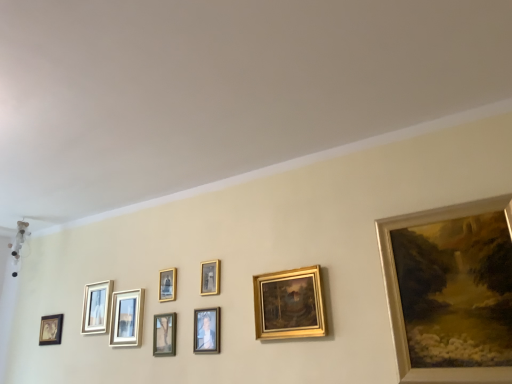
Question: Could you tell me if matte gold picture frame at center, the 6th picture frame viewed from the left, is facing matte black picture frame at lower left, which appears as the first picture frame when viewed from the left?

Choices:
 (A) yes
 (B) no

Answer: (B)

Question: Is matte gold picture frame at center, which is the 4th picture frame from right to left, at the right side of matte black picture frame at lower left, marked as the 9th picture frame in a right-to-left arrangement?

Choices:
 (A) yes
 (B) no

Answer: (A)

Question: Is matte gold picture frame at center, the 6th picture frame viewed from the left, taller than matte black picture frame at lower left, which appears as the first picture frame when viewed from the left?

Choices:
 (A) no
 (B) yes

Answer: (B)

Question: From the image's perspective, is matte gold picture frame at center, the 6th picture frame viewed from the left, located above matte black picture frame at lower left, marked as the 9th picture frame in a right-to-left arrangement?

Choices:
 (A) yes
 (B) no

Answer: (A)

Question: Is matte gold picture frame at center, which is the 4th picture frame from right to left, turned away from matte black picture frame at lower left, which appears as the first picture frame when viewed from the left?

Choices:
 (A) no
 (B) yes

Answer: (A)

Question: Considering the positions of green matte picture frame at center, the fifth picture frame when ordered from left to right, and gold metallic painting at upper right, positioned as the 1th picture frame in right-to-left order, in the image, is green matte picture frame at center, the fifth picture frame when ordered from left to right, bigger or smaller than gold metallic painting at upper right, positioned as the 1th picture frame in right-to-left order,?

Choices:
 (A) small
 (B) big

Answer: (A)

Question: From a real-world perspective, is green matte picture frame at center, marked as the 5th picture frame in a right-to-left arrangement, physically located above or below gold metallic painting at upper right, which is the 9th picture frame from left to right?

Choices:
 (A) below
 (B) above

Answer: (A)

Question: In terms of width, does green matte picture frame at center, marked as the 5th picture frame in a right-to-left arrangement, look wider or thinner when compared to gold metallic painting at upper right, which is the 9th picture frame from left to right?

Choices:
 (A) thin
 (B) wide

Answer: (A)

Question: Is green matte picture frame at center, the fifth picture frame when ordered from left to right, in front of or behind gold metallic painting at upper right, positioned as the 1th picture frame in right-to-left order, in the image?

Choices:
 (A) behind
 (B) front

Answer: (A)

Question: Is gold metallic painting at upper right, which is the 9th picture frame from left to right, spatially inside gold/gilded painting at center, which appears as the 8th picture frame when viewed from the left, or outside of it?

Choices:
 (A) outside
 (B) inside

Answer: (A)

Question: Is point (475, 284) closer or farther from the camera than point (289, 322)?

Choices:
 (A) farther
 (B) closer

Answer: (B)

Question: From the image's perspective, is gold metallic painting at upper right, which is the 9th picture frame from left to right, positioned above or below gold/gilded painting at center, which appears as the 8th picture frame when viewed from the left?

Choices:
 (A) below
 (B) above

Answer: (B)

Question: In the image, is gold metallic painting at upper right, which is the 9th picture frame from left to right, positioned in front of or behind gold/gilded painting at center, the 2th picture frame from the right?

Choices:
 (A) behind
 (B) front

Answer: (B)

Question: Considering the positions of matte black picture frame at lower left, which appears as the first picture frame when viewed from the left, and matte white picture frame at center, which appears as the third picture frame when viewed from the left, in the image, is matte black picture frame at lower left, which appears as the first picture frame when viewed from the left, taller or shorter than matte white picture frame at center, which appears as the third picture frame when viewed from the left,?

Choices:
 (A) short
 (B) tall

Answer: (A)

Question: Is matte black picture frame at lower left, which appears as the first picture frame when viewed from the left, inside or outside of matte white picture frame at center, which appears as the third picture frame when viewed from the left?

Choices:
 (A) outside
 (B) inside

Answer: (A)